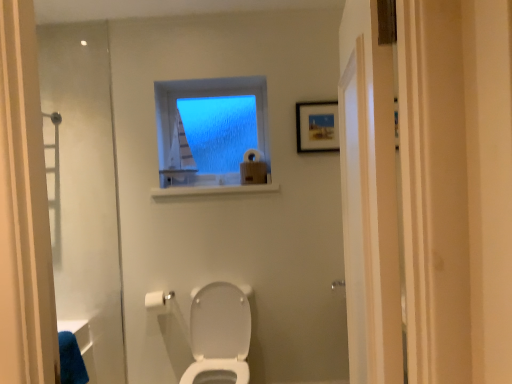
Question: In terms of height, does white matte toilet paper at upper center, which is the 1th toilet paper from top to bottom, look taller or shorter compared to white glossy toilet at center?

Choices:
 (A) short
 (B) tall

Answer: (A)

Question: In terms of size, does white matte toilet paper at upper center, placed as the second toilet paper when sorted from bottom to top, appear bigger or smaller than white glossy toilet at center?

Choices:
 (A) small
 (B) big

Answer: (A)

Question: Which is nearer to the white glossy toilet at center?

Choices:
 (A) white matte toilet paper at upper center, which is the 1th toilet paper from top to bottom
 (B) white matte toilet paper at lower center, which is the 1th toilet paper in left-to-right order
 (C) wooden framed picture at upper right
 (D) blue frosted glass window at upper center

Answer: (B)

Question: Estimate the real-world distances between objects in this image. Which object is closer to the blue frosted glass window at upper center?

Choices:
 (A) white matte toilet paper at upper center, the 1th toilet paper positioned from the back
 (B) white matte toilet paper at lower center, which ranks as the 1th toilet paper in front-to-back order
 (C) white glossy toilet at center
 (D) wooden framed picture at upper right

Answer: (A)